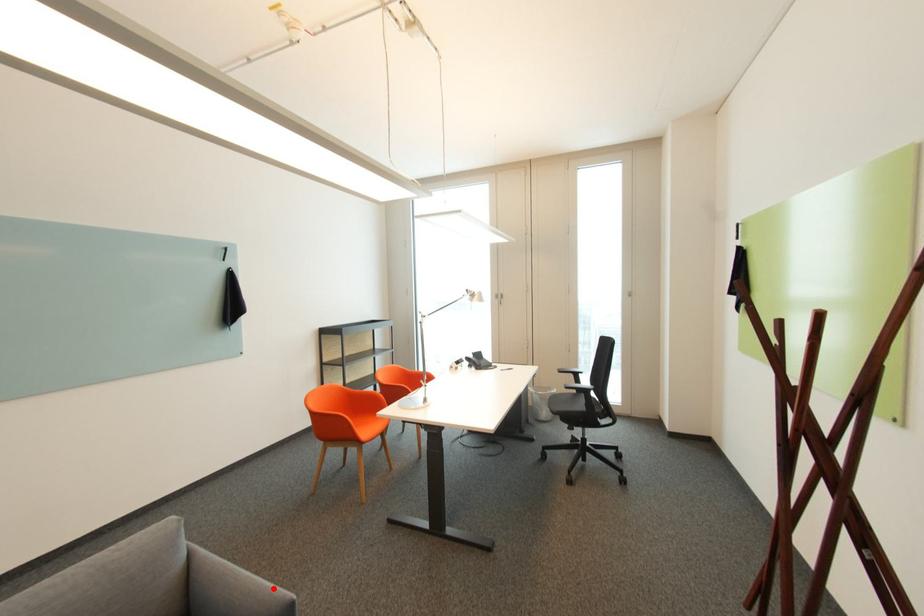
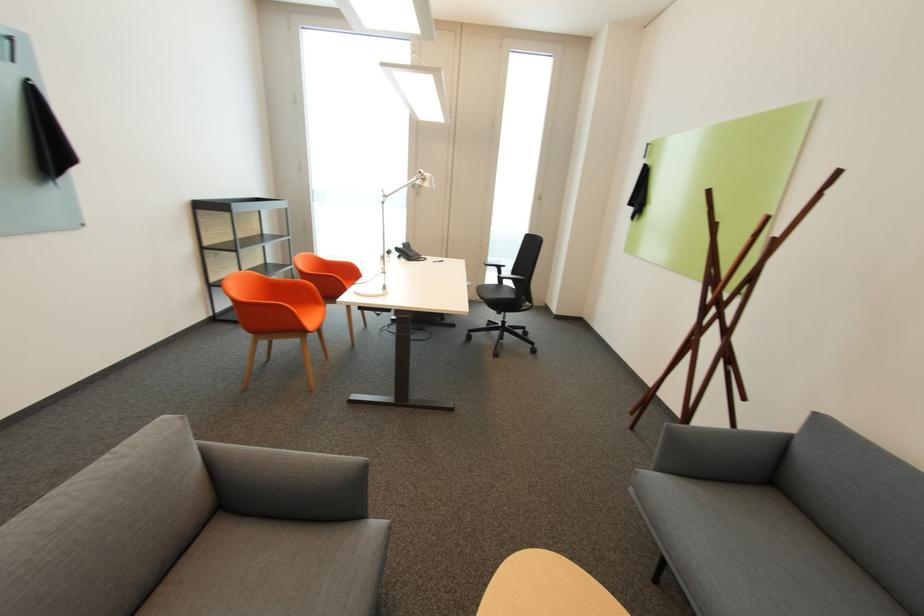
In the second image, find the point that corresponds to the highlighted location in the first image.

(339, 458)